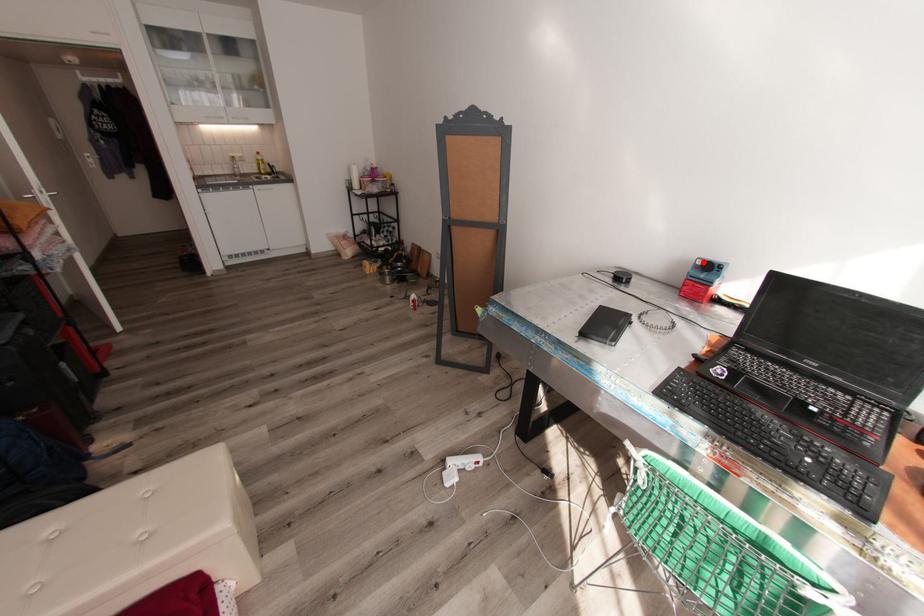
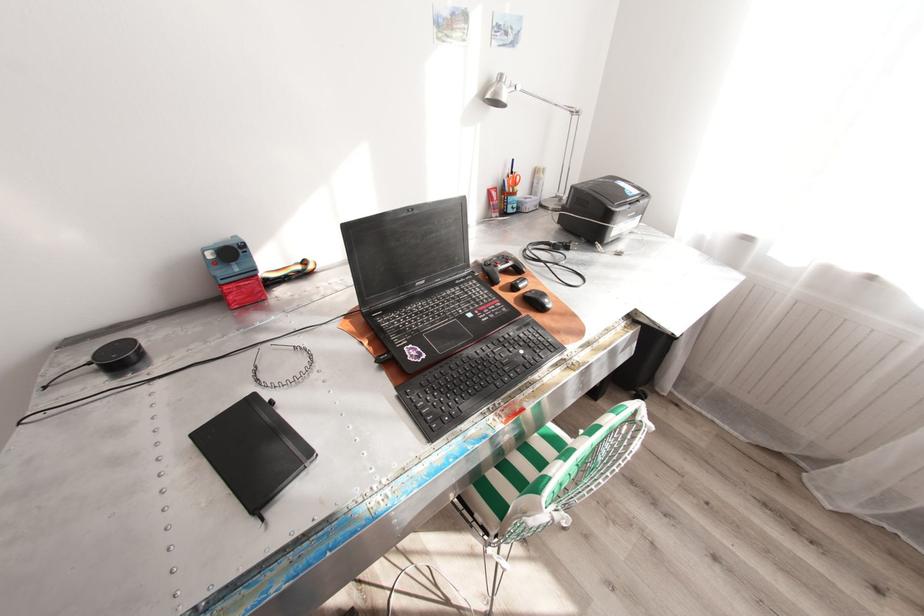
Locate, in the second image, the point that corresponds to the highlighted location in the first image.

(215, 254)